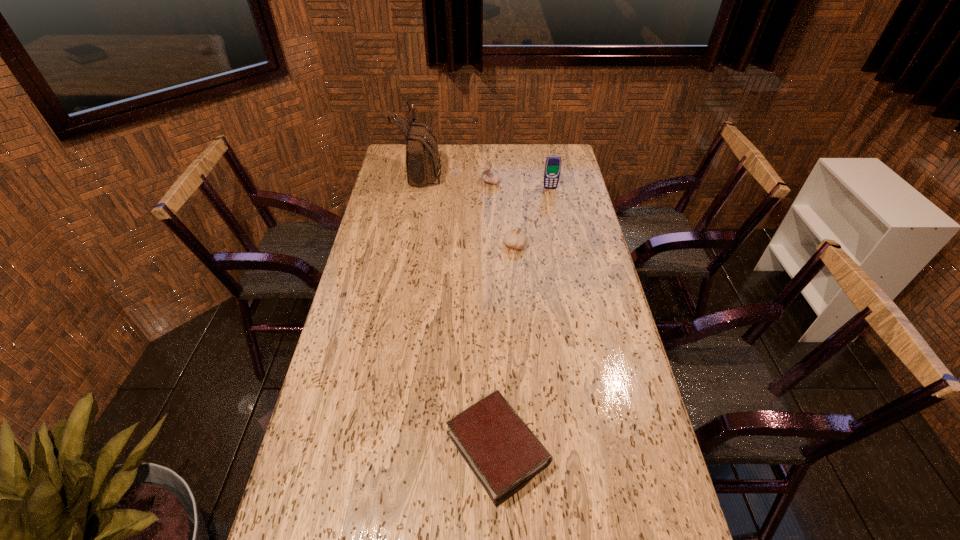
Locate an element on the screen. object that can be found as the closest to the shoulder bag is located at coordinates (491, 176).

Where is `the second closest object to the taller garlic`? the second closest object to the taller garlic is located at coordinates (552, 170).

Point out which garlic is positioned as the nearest to the second tallest object. Please provide its 2D coordinates. Your answer should be formatted as a tuple, i.e. [(x, y)], where the tuple contains the x and y coordinates of a point satisfying the conditions above.

[(491, 176)]

Find the location of `the closest garlic to the shoulder bag`. the closest garlic to the shoulder bag is located at coordinates (491, 176).

Locate an element on the screen. free location that satisfies the following two spatial constraints: 1. on the front-facing side of the taller garlic; 2. on the right side of the leftmost object is located at coordinates (420, 182).

Find the location of a particular element. The height and width of the screenshot is (540, 960). free spot that satisfies the following two spatial constraints: 1. on the front-facing side of the nearest object; 2. on the right side of the tallest object is located at coordinates (374, 449).

Identify the location of blank space that satisfies the following two spatial constraints: 1. on the back side of the taller garlic; 2. on the front-facing side of the tallest object. (491, 172).